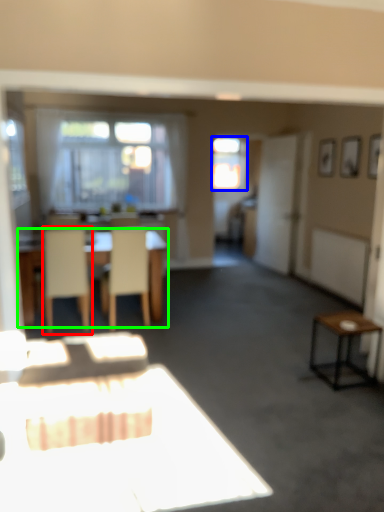
Question: Based on their relative distances, which object is farther from chair (highlighted by a red box)? Choose from window (highlighted by a blue box) and table (highlighted by a green box).

Choices:
 (A) window
 (B) table

Answer: (A)